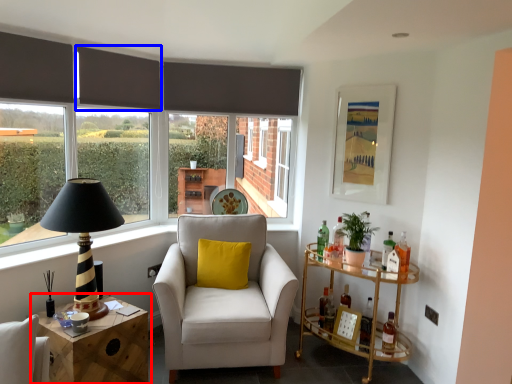
Question: Among these objects, which one is nearest to the camera, table (highlighted by a red box) or curtain (highlighted by a blue box)?

Choices:
 (A) table
 (B) curtain

Answer: (A)